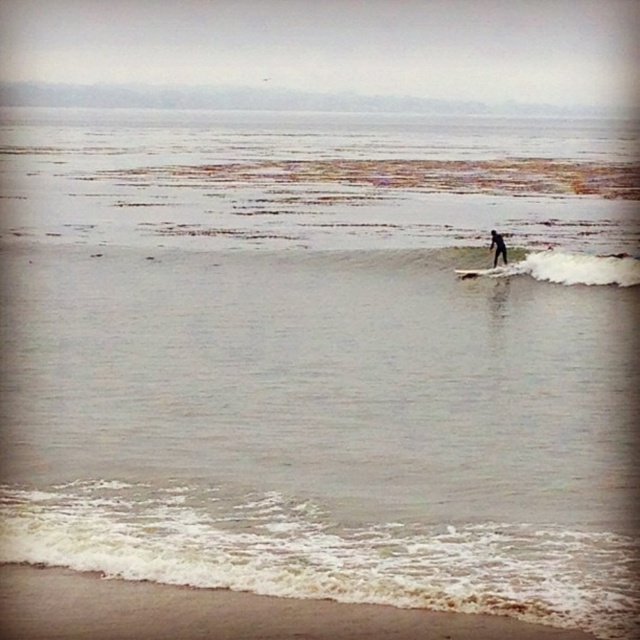
Is white foam surfboard at center smaller than black matte surfboard at center?

No.

Based on the photo, does white foam surfboard at center have a greater width compared to black matte surfboard at center?

Indeed, white foam surfboard at center has a greater width compared to black matte surfboard at center.

You are a GUI agent. You are given a task and a screenshot of the screen. Output one action in this format:
    pyautogui.click(x=<x>, y=<y>)
    Task: Click on the white foam surfboard at center
    This screenshot has width=640, height=640.
    Given the screenshot: What is the action you would take?
    pyautogui.click(x=484, y=272)

Identify the location of white foam surfboard at center. The height and width of the screenshot is (640, 640). (484, 272).